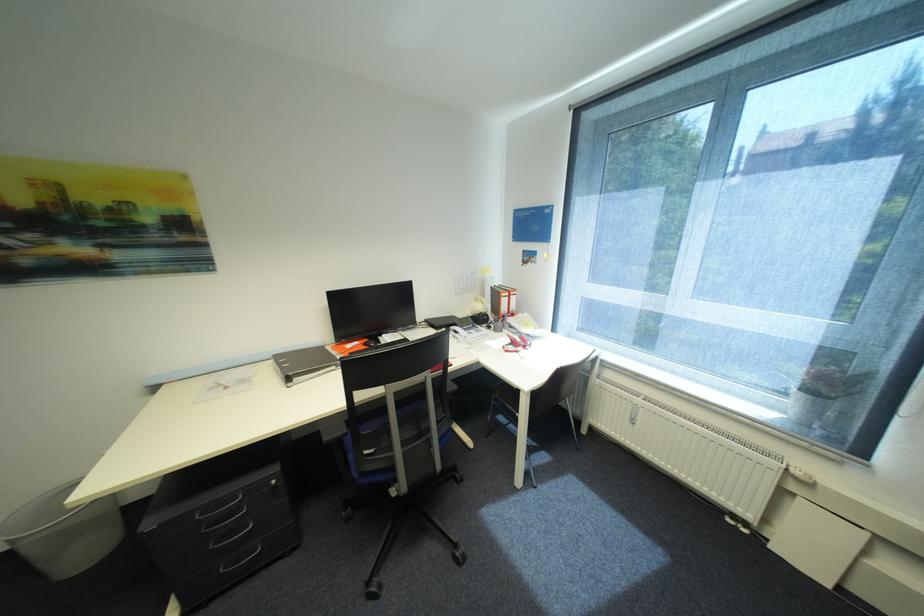
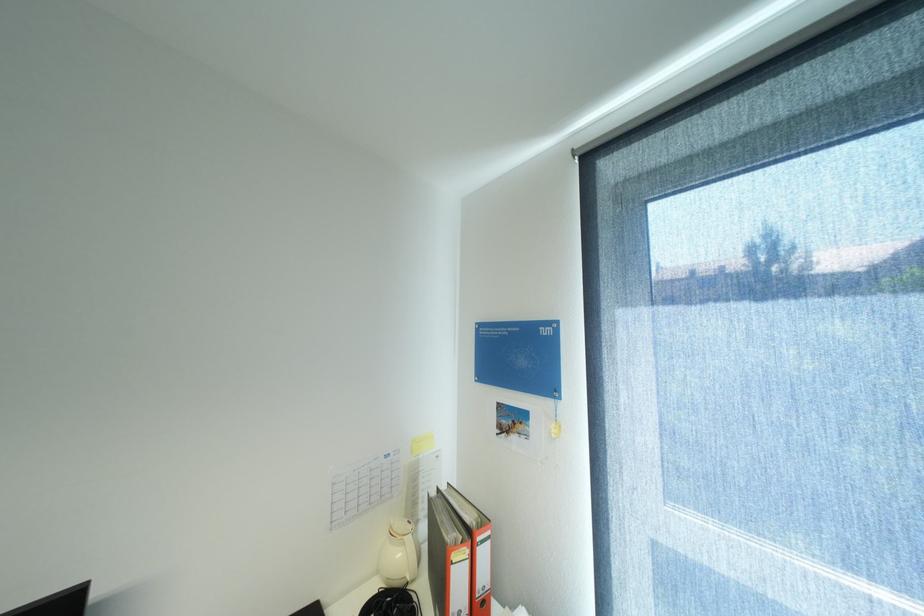
Where in the second image is the point corresponding to [488,307] from the first image?

(407, 554)